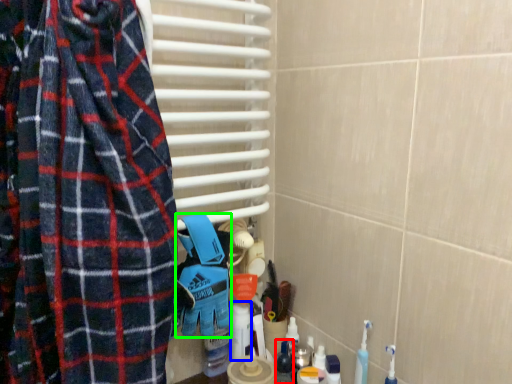
Question: Based on their relative distances, which object is nearer to toiletry (highlighted by a red box)? Choose from cleaning product (highlighted by a blue box) and blanket (highlighted by a green box).

Choices:
 (A) cleaning product
 (B) blanket

Answer: (A)